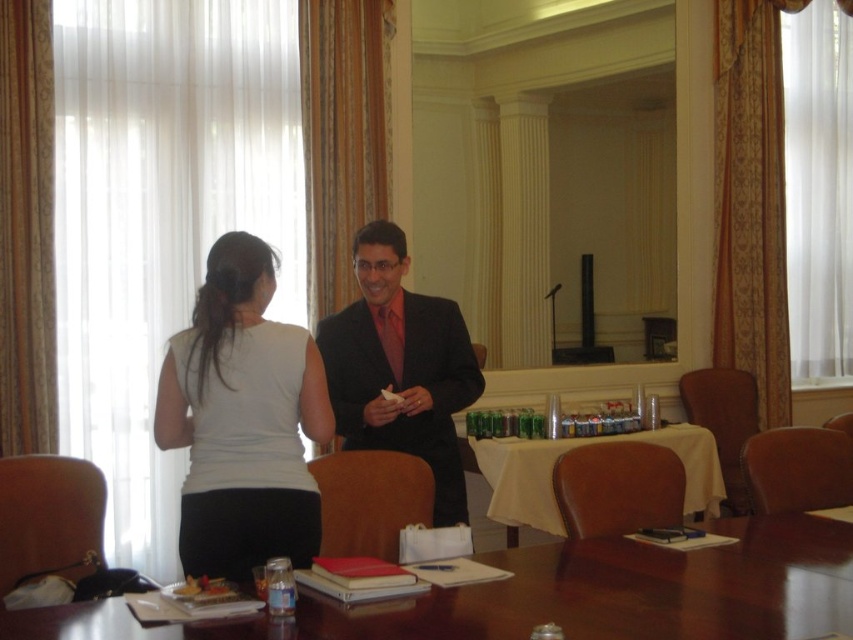
Question: Which object appears closest to the camera in this image?

Choices:
 (A) shiny brown table at center
 (B) white matte shirt at upper left
 (C) white cloth table at center

Answer: (A)

Question: Observing the image, what is the correct spatial positioning of shiny brown table at center in reference to white cloth table at center?

Choices:
 (A) right
 (B) left

Answer: (B)

Question: Observing the image, what is the correct spatial positioning of shiny brown table at center in reference to matte black suit at center?

Choices:
 (A) above
 (B) below

Answer: (B)

Question: Which point is closer to the camera?

Choices:
 (A) matte black suit at center
 (B) shiny brown table at center
 (C) white cloth table at center
 (D) white matte shirt at upper left

Answer: (B)

Question: Among these points, which one is farthest from the camera?

Choices:
 (A) (248, 355)
 (B) (556, 529)

Answer: (B)

Question: Does shiny brown table at center have a lesser width compared to matte black suit at center?

Choices:
 (A) no
 (B) yes

Answer: (A)